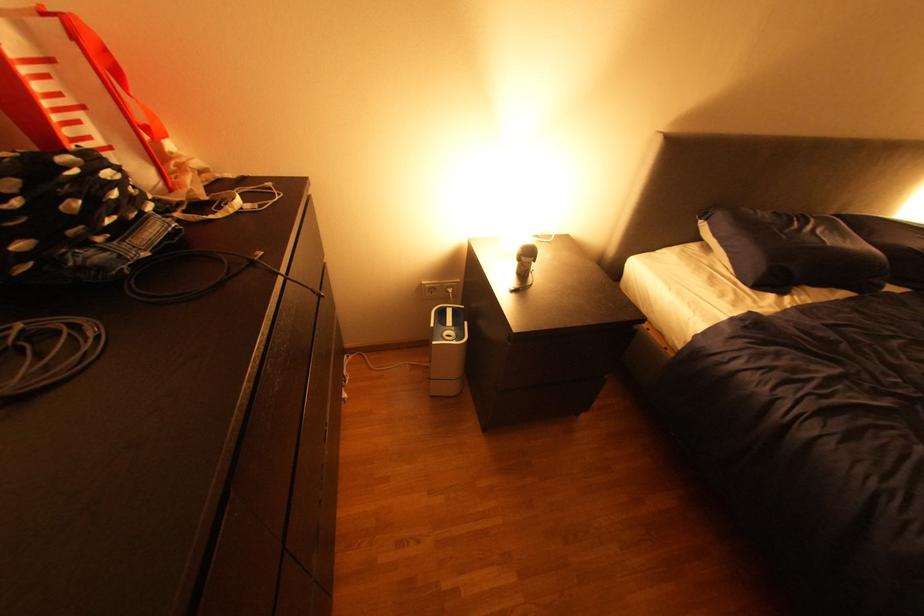
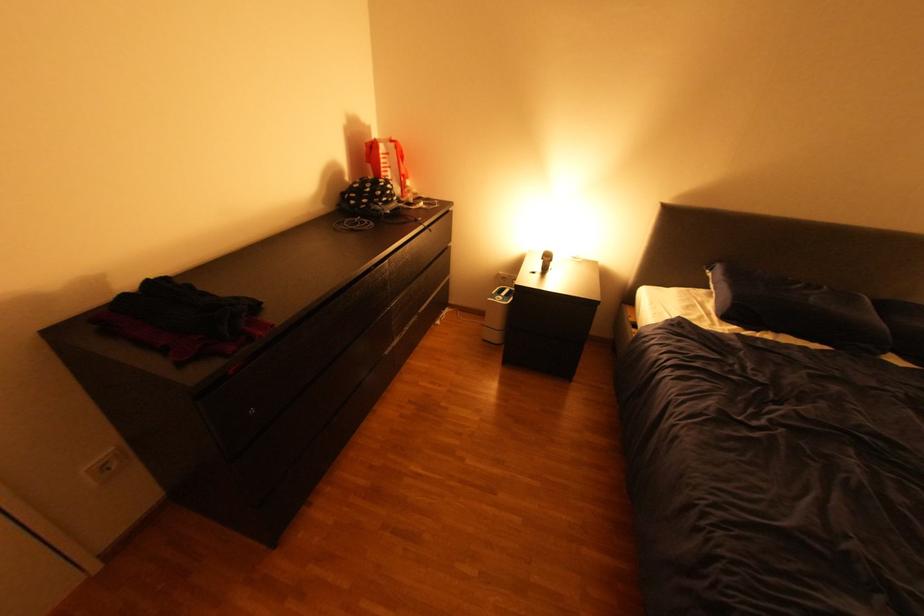
Locate, in the second image, the point that corresponds to pixel 781 294 in the first image.

(745, 326)